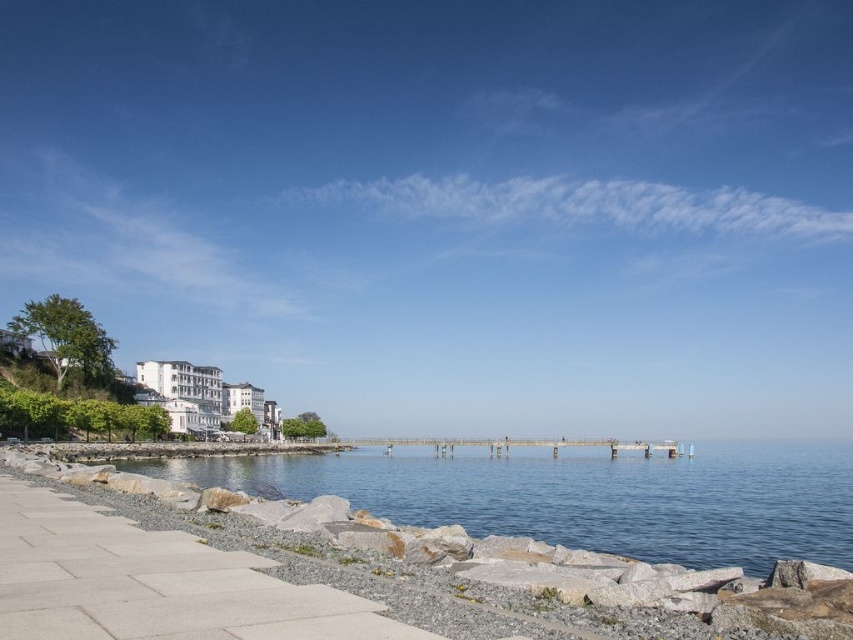
Who is taller, clear blue water at center or gray concrete pavement at lower left?

clear blue water at center is taller.

At what (x,y) coordinates should I click in order to perform the action: click on clear blue water at center. Please return your answer as a coordinate pair (x, y). The height and width of the screenshot is (640, 853). Looking at the image, I should click on (582, 497).